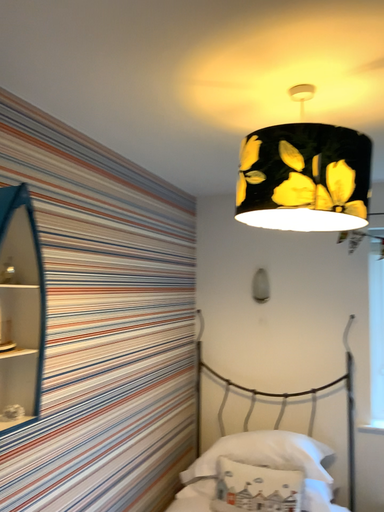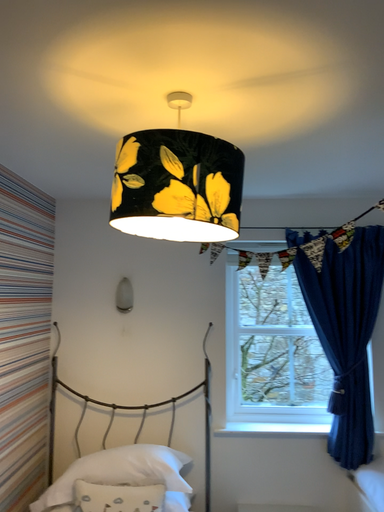
Question: How did the camera likely rotate when shooting the video?

Choices:
 (A) rotated left
 (B) rotated right

Answer: (B)